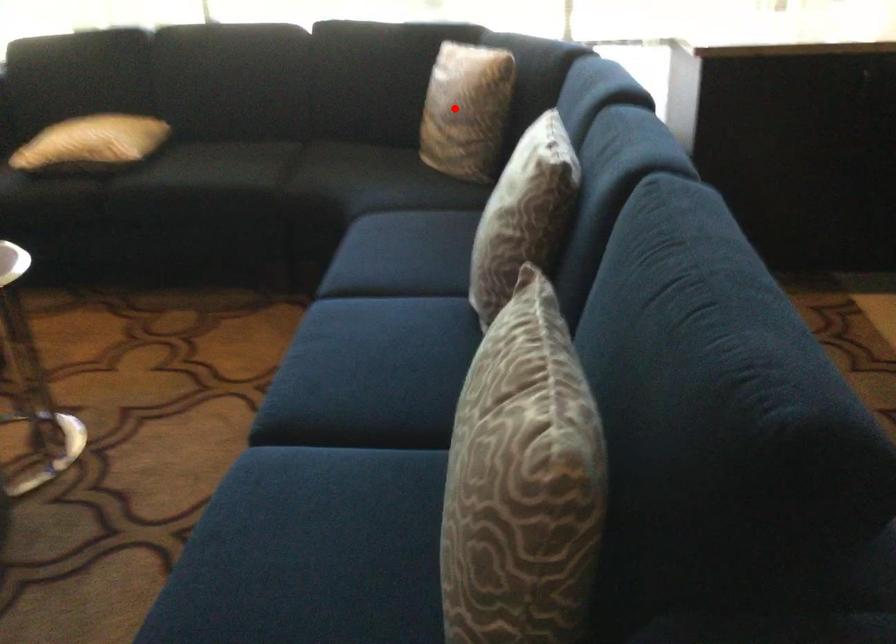
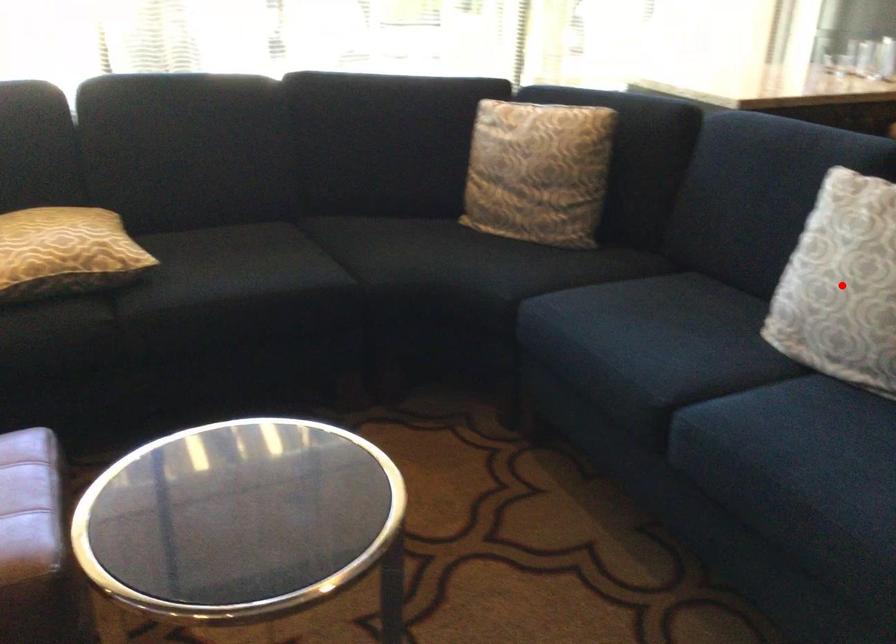
I am providing you with two images of the same scene from different viewpoints. A red point is marked on the first image and another point is marked on the second image. Is the red point in image1 aligned with the point shown in image2?

No